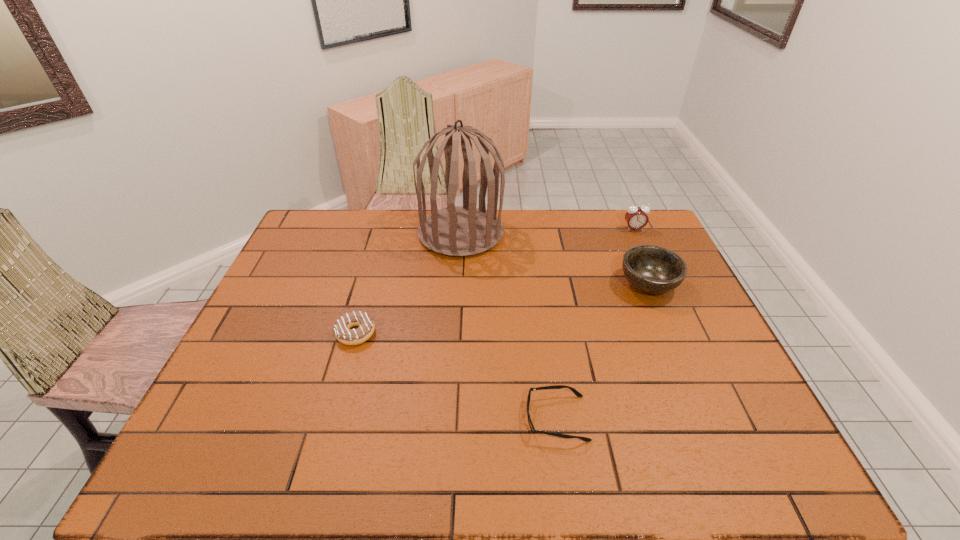
Locate an element on the screen. The width and height of the screenshot is (960, 540). bowl positioned at the right edge is located at coordinates (652, 269).

What are the coordinates of `object that is at the far right corner` in the screenshot? It's located at (636, 217).

Find the location of `vacant area at the far edge of the desktop`. vacant area at the far edge of the desktop is located at coordinates (385, 247).

In the image, there is a desktop. Identify the location of vacant area at the near edge. The image size is (960, 540). (640, 459).

In the image, there is a desktop. What are the coordinates of `vacant space at the left edge` in the screenshot? It's located at (241, 403).

Locate an element on the screen. free space at the right edge of the desktop is located at coordinates (722, 415).

Find the location of `vacant space at the far left corner of the desktop`. vacant space at the far left corner of the desktop is located at coordinates (317, 227).

Where is `vacant space that's between the alarm clock and the nearest object`? vacant space that's between the alarm clock and the nearest object is located at coordinates (595, 323).

This screenshot has height=540, width=960. In order to click on free space that is in between the nearest object and the birdcage in this screenshot , I will do [x=509, y=326].

At what (x,y) coordinates should I click in order to perform the action: click on free space that is in between the nearest object and the second nearest object. Please return your answer as a coordinate pair (x, y). Looking at the image, I should click on (456, 376).